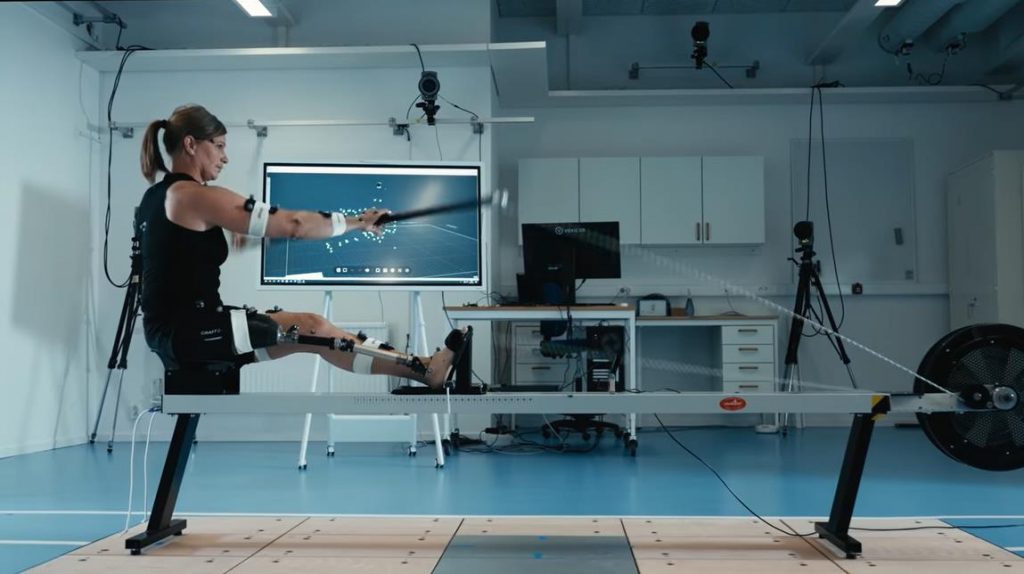
Locate an element on the screen. The height and width of the screenshot is (574, 1024). monitor is located at coordinates coord(421,257).